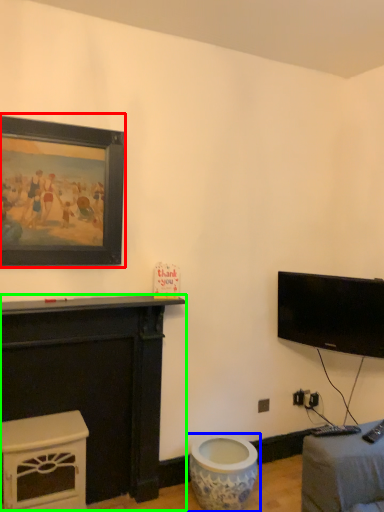
Question: Which object is the farthest from picture frame (highlighted by a red box)? Choose among these: toilet (highlighted by a blue box) or furniture (highlighted by a green box).

Choices:
 (A) toilet
 (B) furniture

Answer: (A)